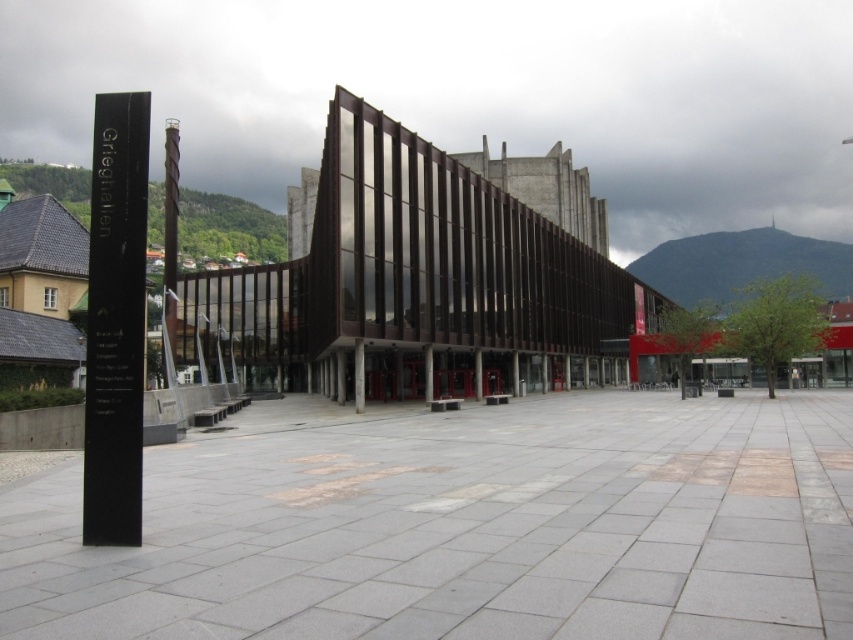
Question: Does black polished stone pole at left appear on the left side of dark brown polished wood pole at left?

Choices:
 (A) no
 (B) yes

Answer: (A)

Question: Can you confirm if black polished stone pole at left is thinner than dark brown polished wood pole at left?

Choices:
 (A) no
 (B) yes

Answer: (B)

Question: Which point is farther to the camera?

Choices:
 (A) dark brown polished wood pole at left
 (B) black polished stone pole at left

Answer: (A)

Question: Does black polished stone pole at left come in front of dark brown polished wood pole at left?

Choices:
 (A) yes
 (B) no

Answer: (A)

Question: Among these points, which one is nearest to the camera?

Choices:
 (A) (172, 218)
 (B) (125, 435)

Answer: (B)